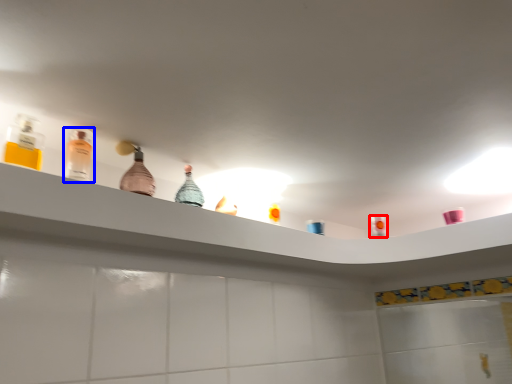
Question: Which point is closer to the camera, mouthwash (highlighted by a red box) or bottle (highlighted by a blue box)?

Choices:
 (A) mouthwash
 (B) bottle

Answer: (B)